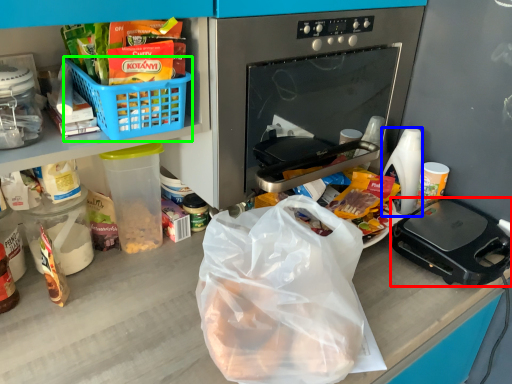
Question: Estimate the real-world distances between objects in this image. Which object is closer to kitchen appliance (highlighted by a red box), coffee cup (highlighted by a blue box) or basket (highlighted by a green box)?

Choices:
 (A) coffee cup
 (B) basket

Answer: (A)